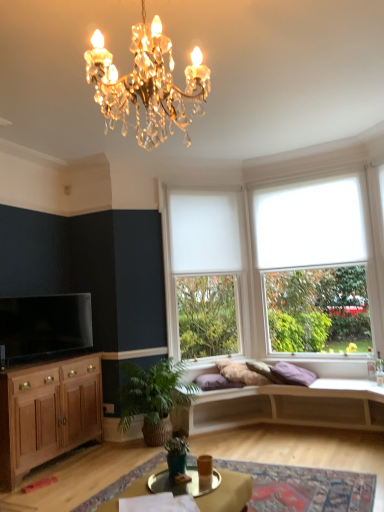
Find the location of a particular element. The image size is (384, 512). free spot below white matte studio couch at center (from a real-world perspective) is located at coordinates pyautogui.click(x=284, y=440).